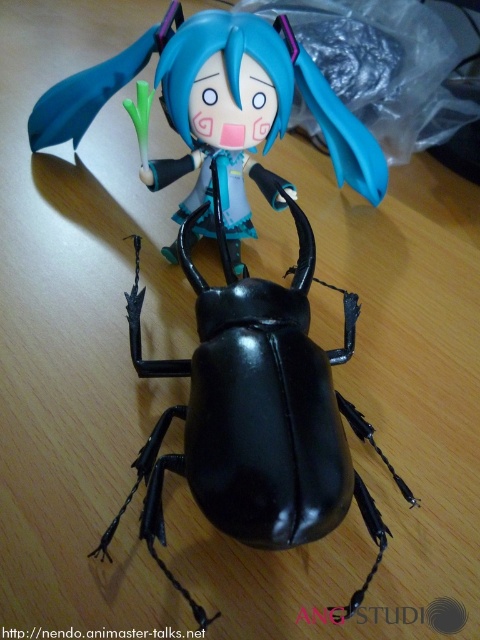
You are an art collector who wants to display both the black glossy beetle at center and the glossy black beetle at center on a shelf. The shelf has a total length of 12 inches. Can both items fit side by side on the shelf without overlapping?

The black glossy beetle at center is 11.27 inches from the glossy black beetle at center. Since the shelf is 12 inches long, there is enough space to place both items side by side as the combined length required is 11.27 inches, which is less than 12 inches.

You are standing in front of the image and want to know how far the point at coordinates (x=260, y=304) is from you. Can you determine the distance?

The point at coordinates (x=260, y=304) is 1.17 meters away from the viewer.

You are a photographer setting up a shot of the black glossy beetle at center. You want to ensure the beetle is in focus while the Hatsune Miku figurine behind it is slightly blurred. What is the minimum distance you should set your camera focus to achieve this?

The minimum distance you should set your camera focus to is 38.58 inches to ensure the black glossy beetle at center is in focus while the Hatsune Miku figurine behind it is blurred.